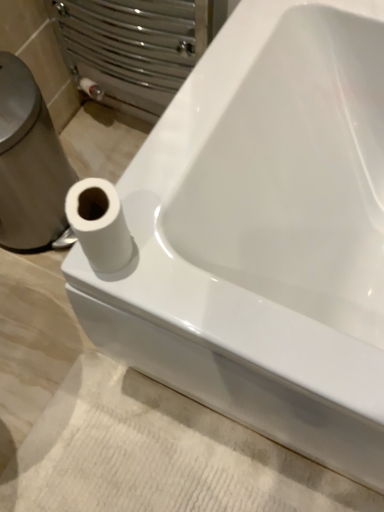
Question: Should I look upward or downward to see white glossy toilet paper at left?

Choices:
 (A) down
 (B) up

Answer: (B)

Question: Considering the relative sizes of white textured bath mat at lower left and white matte toilet paper at lower left in the image provided, is white textured bath mat at lower left smaller than white matte toilet paper at lower left?

Choices:
 (A) no
 (B) yes

Answer: (A)

Question: Considering the relative sizes of white textured bath mat at lower left and white matte toilet paper at lower left in the image provided, is white textured bath mat at lower left wider than white matte toilet paper at lower left?

Choices:
 (A) yes
 (B) no

Answer: (A)

Question: Does white textured bath mat at lower left lie behind white matte toilet paper at lower left?

Choices:
 (A) yes
 (B) no

Answer: (A)

Question: Does white textured bath mat at lower left have a lesser width compared to white matte toilet paper at lower left?

Choices:
 (A) no
 (B) yes

Answer: (A)

Question: Does white textured bath mat at lower left have a larger size compared to white matte toilet paper at lower left?

Choices:
 (A) no
 (B) yes

Answer: (B)

Question: Considering the relative sizes of white textured bath mat at lower left and white matte toilet paper at lower left in the image provided, is white textured bath mat at lower left shorter than white matte toilet paper at lower left?

Choices:
 (A) yes
 (B) no

Answer: (A)

Question: Considering the relative sizes of white matte toilet paper at lower left and white textured bath mat at lower left in the image provided, is white matte toilet paper at lower left smaller than white textured bath mat at lower left?

Choices:
 (A) no
 (B) yes

Answer: (B)

Question: Could white textured bath mat at lower left be considered to be inside white matte toilet paper at lower left?

Choices:
 (A) yes
 (B) no

Answer: (B)

Question: Does white matte toilet paper at lower left appear on the right side of white textured bath mat at lower left?

Choices:
 (A) yes
 (B) no

Answer: (B)

Question: Is white matte toilet paper at lower left not inside white textured bath mat at lower left?

Choices:
 (A) yes
 (B) no

Answer: (A)

Question: Is white matte toilet paper at lower left oriented away from white textured bath mat at lower left?

Choices:
 (A) no
 (B) yes

Answer: (A)

Question: From the image's perspective, does white matte toilet paper at lower left appear lower than white textured bath mat at lower left?

Choices:
 (A) yes
 (B) no

Answer: (B)

Question: Considering the relative positions of white glossy toilet paper at left and white matte toilet paper at lower left in the image provided, is white glossy toilet paper at left to the right of white matte toilet paper at lower left from the viewer's perspective?

Choices:
 (A) no
 (B) yes

Answer: (A)